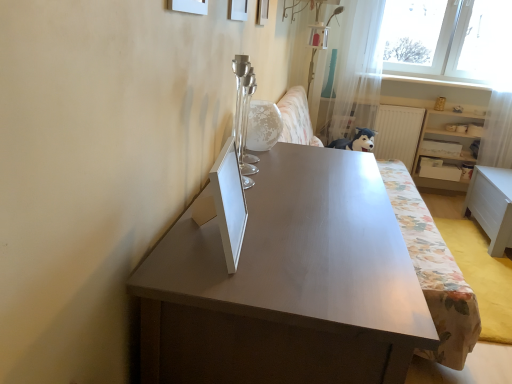
Question: Is white matte drawer at right completely or partially outside of white glossy globe at center?

Choices:
 (A) no
 (B) yes

Answer: (B)

Question: Does white matte drawer at right lie in front of white glossy globe at center?

Choices:
 (A) no
 (B) yes

Answer: (A)

Question: Does white matte drawer at right have a greater height compared to white glossy globe at center?

Choices:
 (A) yes
 (B) no

Answer: (B)

Question: Is white matte drawer at right oriented towards white glossy globe at center?

Choices:
 (A) no
 (B) yes

Answer: (A)

Question: From the image's perspective, is white matte drawer at right located above white glossy globe at center?

Choices:
 (A) yes
 (B) no

Answer: (B)

Question: Considering the relative sizes of white matte drawer at right and white glossy globe at center in the image provided, is white matte drawer at right shorter than white glossy globe at center?

Choices:
 (A) yes
 (B) no

Answer: (A)

Question: Considering the relative sizes of translucent fabric curtain at upper right and white wooden shelf at right in the image provided, is translucent fabric curtain at upper right taller than white wooden shelf at right?

Choices:
 (A) yes
 (B) no

Answer: (A)

Question: From a real-world perspective, is translucent fabric curtain at upper right under white wooden shelf at right?

Choices:
 (A) no
 (B) yes

Answer: (A)

Question: Does translucent fabric curtain at upper right come in front of white wooden shelf at right?

Choices:
 (A) yes
 (B) no

Answer: (A)

Question: Can you confirm if translucent fabric curtain at upper right is bigger than white wooden shelf at right?

Choices:
 (A) no
 (B) yes

Answer: (B)

Question: Is translucent fabric curtain at upper right far from white wooden shelf at right?

Choices:
 (A) no
 (B) yes

Answer: (A)

Question: Is translucent fabric curtain at upper right at the left side of white wooden shelf at right?

Choices:
 (A) no
 (B) yes

Answer: (B)

Question: Considering the relative sizes of floral fabric couch at center and white matte picture frame at upper center, which is the 2th picture frame from back to front, in the image provided, is floral fabric couch at center smaller than white matte picture frame at upper center, which is the 2th picture frame from back to front,?

Choices:
 (A) no
 (B) yes

Answer: (A)